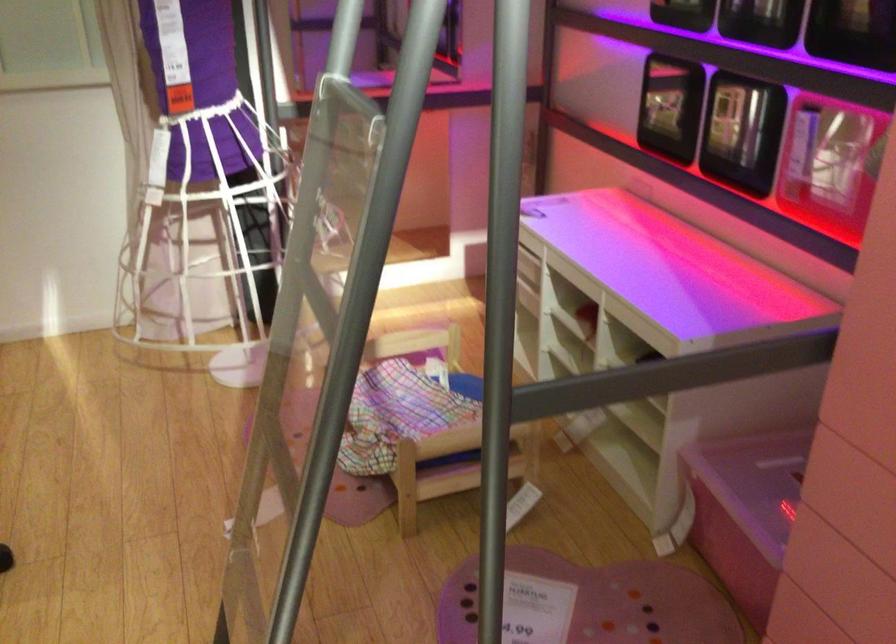
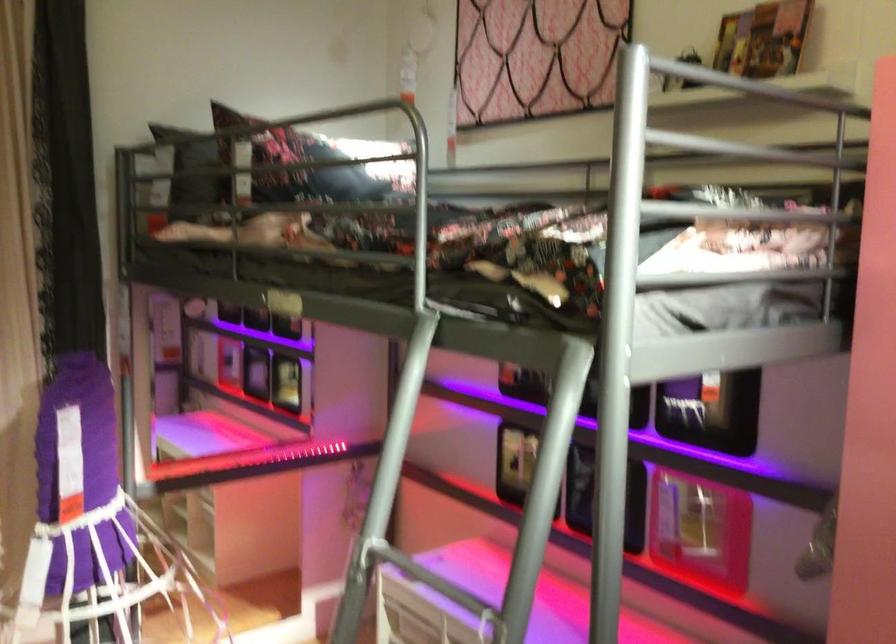
Question: Which direction would the cameraman need to move to produce the second image? Reply with the corresponding letter.

Choices:
 (A) Left
 (B) Right
 (C) Forward
 (D) Backward

Answer: (A)